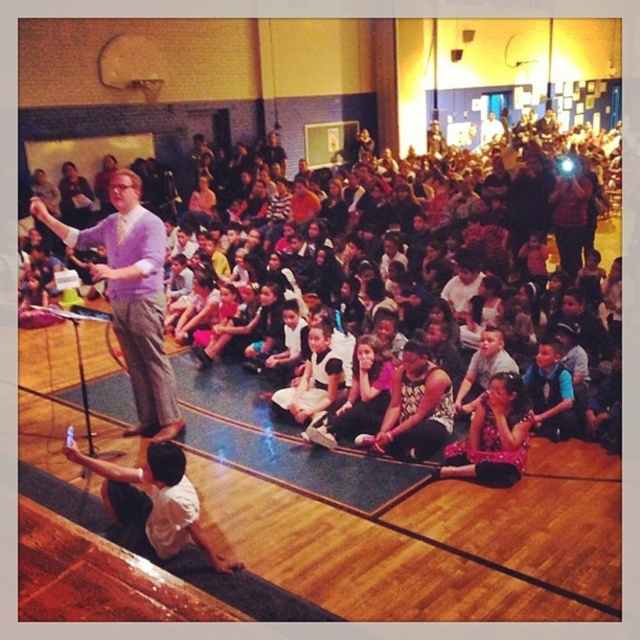
Question: Among these objects, which one is farthest from the camera?

Choices:
 (A) patterned fabric dress at center
 (B) printed cotton dress at lower center
 (C) white cotton dress at center
 (D) multicolored fabric children at center

Answer: (C)

Question: Can you confirm if printed cotton dress at lower center is positioned below patterned fabric dress at center?

Choices:
 (A) no
 (B) yes

Answer: (B)

Question: Which of the following is the closest to the observer?

Choices:
 (A) white cotton dress at center
 (B) purple shirt at center

Answer: (B)

Question: Among these points, which one is nearest to the camera?

Choices:
 (A) (516, 465)
 (B) (548, 355)

Answer: (A)

Question: Is multicolored fabric children at center bigger than white cotton dress at center?

Choices:
 (A) no
 (B) yes

Answer: (B)

Question: Is patterned fabric dress at center above white cotton dress at center?

Choices:
 (A) yes
 (B) no

Answer: (B)